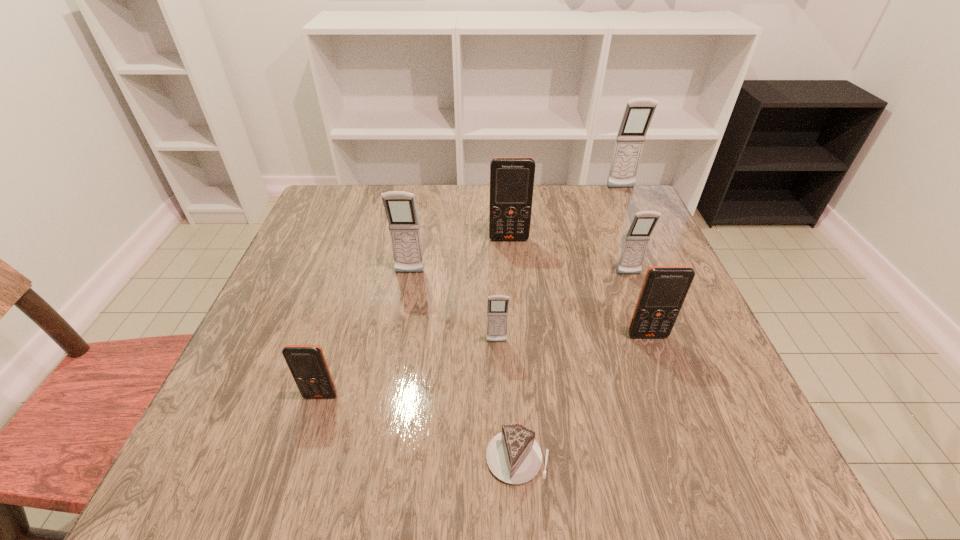
Identify the location of free space between the nearest gray cellular telephone and the shortest object. This screenshot has height=540, width=960. (507, 400).

I want to click on unoccupied area between the smallest gray cellular telephone and the second smallest gray cellular telephone, so click(x=563, y=308).

Locate an element on the screen. The height and width of the screenshot is (540, 960). vacant space that is in between the third gray cellular telephone from left to right and the biggest gray cellular telephone is located at coordinates (625, 231).

Locate an element on the screen. the second closest object to the rightmost cellular telephone is located at coordinates (636, 241).

Choose which object is the third nearest neighbor to the farthest cellular telephone. Please provide its 2D coordinates. Your answer should be formatted as a tuple, i.e. [(x, y)], where the tuple contains the x and y coordinates of a point satisfying the conditions above.

[(664, 289)]

Identify which cellular telephone is the closest to the second biggest orange cellular telephone. Please provide its 2D coordinates. Your answer should be formatted as a tuple, i.e. [(x, y)], where the tuple contains the x and y coordinates of a point satisfying the conditions above.

[(636, 241)]

Locate an element on the screen. This screenshot has width=960, height=540. cellular telephone that is the fifth closest to the nearest object is located at coordinates (636, 241).

Locate which gray cellular telephone is the closest to the tallest object. Please provide its 2D coordinates. Your answer should be formatted as a tuple, i.e. [(x, y)], where the tuple contains the x and y coordinates of a point satisfying the conditions above.

[(636, 241)]

Locate which gray cellular telephone ranks second in proximity to the nearest gray cellular telephone. Please provide its 2D coordinates. Your answer should be formatted as a tuple, i.e. [(x, y)], where the tuple contains the x and y coordinates of a point satisfying the conditions above.

[(636, 241)]

Where is `orange cellular telephone that is the second closest to the leftmost orange cellular telephone`? orange cellular telephone that is the second closest to the leftmost orange cellular telephone is located at coordinates (664, 289).